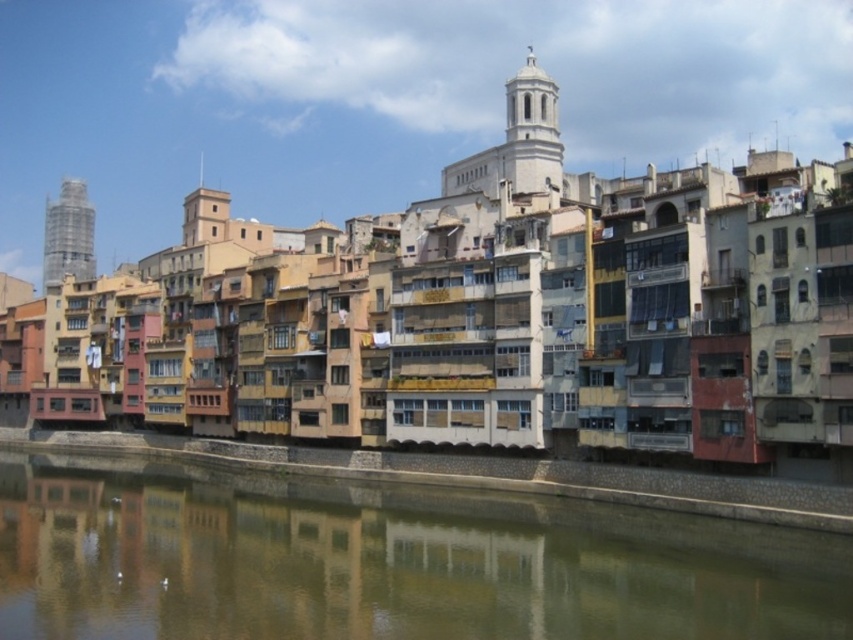
Does smooth concrete river at center have a lesser height compared to smooth gray concrete tower at left?

Yes, smooth concrete river at center is shorter than smooth gray concrete tower at left.

Is smooth concrete river at center bigger than smooth gray concrete tower at left?

No, smooth concrete river at center is not bigger than smooth gray concrete tower at left.

The image size is (853, 640). What do you see at coordinates (384, 561) in the screenshot? I see `smooth concrete river at center` at bounding box center [384, 561].

Find the location of a particular element. This screenshot has height=640, width=853. smooth concrete river at center is located at coordinates (384, 561).